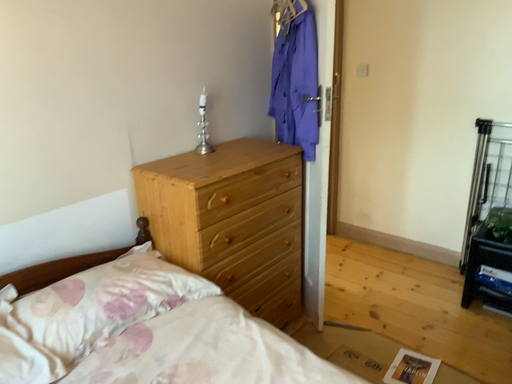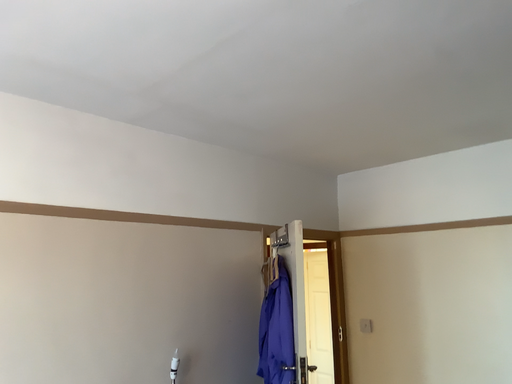
Question: Which way did the camera rotate in the video?

Choices:
 (A) rotated upward
 (B) rotated downward

Answer: (A)